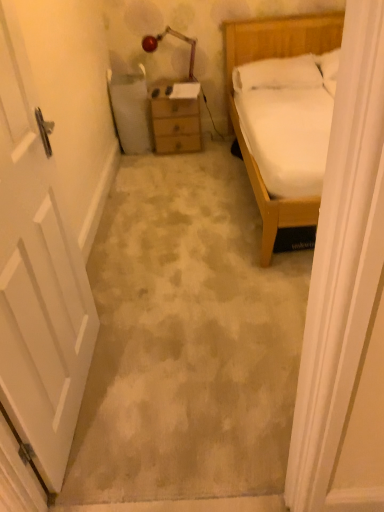
Identify the location of metallic red lamp at upper center. (176, 37).

Find the location of `wooden chest of drawers at center`. wooden chest of drawers at center is located at coordinates click(x=176, y=118).

Where is `metallic red lamp at upper center`? The image size is (384, 512). metallic red lamp at upper center is located at coordinates (176, 37).

Which object is positioned more to the right, white soft pillow at upper right or white matte door at left?

white soft pillow at upper right.

From the image's perspective, would you say white soft pillow at upper right is shown under white matte door at left?

No, from the image's perspective, white soft pillow at upper right is not beneath white matte door at left.

Between white soft pillow at upper right and white matte door at left, which one has less height?

white soft pillow at upper right is shorter.

Is white soft pillow at upper right located outside white matte door at left?

Yes, white soft pillow at upper right is located beyond the bounds of white matte door at left.

From a real-world perspective, is metallic red lamp at upper center positioned over white matte door at left based on gravity?

Yes, from a real-world perspective, metallic red lamp at upper center is above white matte door at left.

Considering the relative sizes of metallic red lamp at upper center and white matte door at left in the image provided, is metallic red lamp at upper center smaller than white matte door at left?

Indeed, metallic red lamp at upper center has a smaller size compared to white matte door at left.

Considering the points (146, 52) and (193, 426), which point is in front, point (146, 52) or point (193, 426)?

The point (193, 426) is closer to the camera.

Is the surface of metallic red lamp at upper center in direct contact with white matte door at left?

metallic red lamp at upper center is not next to white matte door at left, and they're not touching.

Could you tell me if metallic red lamp at upper center is facing white matte door at left?

Yes, metallic red lamp at upper center is facing white matte door at left.

Based on the photo, between metallic red lamp at upper center and white matte door at left, which one has larger width?

Wider between the two is metallic red lamp at upper center.

Are metallic red lamp at upper center and white matte door at left far apart?

Yes, metallic red lamp at upper center is far from white matte door at left.

From a real-world perspective, which is physically below, metallic red lamp at upper center or white matte door at left?

white matte door at left.

Does white matte door at left have a smaller size compared to white soft pillow at upper right?

No, white matte door at left is not smaller than white soft pillow at upper right.

Is white matte door at left directly adjacent to white soft pillow at upper right?

No, white matte door at left is not in contact with white soft pillow at upper right.

Locate an element on the screen. The image size is (384, 512). pillow located above the white matte door at left (from the image's perspective) is located at coordinates (280, 73).

Which point is more forward, (x=32, y=177) or (x=270, y=61)?

The point (x=32, y=177) is closer.

Considering the relative sizes of white matte door at left and metallic red lamp at upper center in the image provided, is white matte door at left wider than metallic red lamp at upper center?

No.

Is metallic red lamp at upper center at the back of white matte door at left?

No, white matte door at left is not facing the opposite direction of metallic red lamp at upper center.

Considering the sizes of objects white matte door at left and metallic red lamp at upper center in the image provided, who is bigger, white matte door at left or metallic red lamp at upper center?

Bigger between the two is white matte door at left.

Is white matte door at left in front of or behind metallic red lamp at upper center in the image?

In the image, white matte door at left appears in front of metallic red lamp at upper center.

Between point (324, 77) and point (187, 38), which one is positioned behind?

Positioned behind is point (187, 38).

Considering the positions of objects white soft pillow at upper right and metallic red lamp at upper center in the image provided, who is more to the left, white soft pillow at upper right or metallic red lamp at upper center?

Positioned to the left is metallic red lamp at upper center.

Would you say white soft pillow at upper right is a long distance from metallic red lamp at upper center?

white soft pillow at upper right is actually quite close to metallic red lamp at upper center.

From a real-world perspective, which object stands above the other?

In real-world perspective, metallic red lamp at upper center is above.

Can you confirm if wooden chest of drawers at center is taller than white matte door at left?

Incorrect, the height of wooden chest of drawers at center is not larger of that of white matte door at left.

Is wooden chest of drawers at center thinner than white matte door at left?

No, wooden chest of drawers at center is not thinner than white matte door at left.

Is wooden chest of drawers at center turned away from white matte door at left?

No.

Would you say wooden chest of drawers at center is to the left or to the right of white matte door at left in the picture?

Clearly, wooden chest of drawers at center is on the right of white matte door at left in the image.

Where is `door that is below the white soft pillow at upper right (from the image's perspective)`? door that is below the white soft pillow at upper right (from the image's perspective) is located at coordinates (38, 276).

At what (x,y) coordinates should I click in order to perform the action: click on lamp that is above the white matte door at left (from a real-world perspective). Please return your answer as a coordinate pair (x, y). The image size is (384, 512). Looking at the image, I should click on (176, 37).

Based on their spatial positions, is metallic red lamp at upper center or wooden chest of drawers at center further from white matte door at left?

Among the two, metallic red lamp at upper center is located further to white matte door at left.

Looking at the image, which one is located closer to white matte door at left, white soft pillow at upper right or metallic red lamp at upper center?

white soft pillow at upper right is positioned closer to the anchor white matte door at left.

Looking at the image, which one is located closer to white matte door at left, white matte door at left or white soft pillow at upper right?

Among the two, white matte door at left is located nearer to white matte door at left.

Based on their spatial positions, is white soft pillow at upper right or white matte door at left further from white matte door at left?

white soft pillow at upper right lies further to white matte door at left than the other object.

When comparing their distances from metallic red lamp at upper center, does wooden chest of drawers at center or white matte door at left seem further?

white matte door at left is further to metallic red lamp at upper center.

Looking at the image, which one is located closer to white matte door at left, metallic red lamp at upper center or wooden chest of drawers at center?

wooden chest of drawers at center.

Based on their spatial positions, is wooden chest of drawers at center or metallic red lamp at upper center further from white matte door at left?

metallic red lamp at upper center.

When comparing their distances from white matte door at left, does wooden chest of drawers at center or white soft pillow at upper right seem further?

white soft pillow at upper right is further to white matte door at left.

The width and height of the screenshot is (384, 512). I want to click on concrete positioned between white matte door at left and wooden chest of drawers at center from near to far, so click(x=187, y=340).

This screenshot has width=384, height=512. Identify the location of concrete between white matte door at left and metallic red lamp at upper center in the front-back direction. (187, 340).

Where is `pillow located between white matte door at left and wooden chest of drawers at center in the depth direction`? The width and height of the screenshot is (384, 512). pillow located between white matte door at left and wooden chest of drawers at center in the depth direction is located at coordinates (280, 73).

Where is `pillow located between white matte door at left and metallic red lamp at upper center in the depth direction`? This screenshot has width=384, height=512. pillow located between white matte door at left and metallic red lamp at upper center in the depth direction is located at coordinates (280, 73).